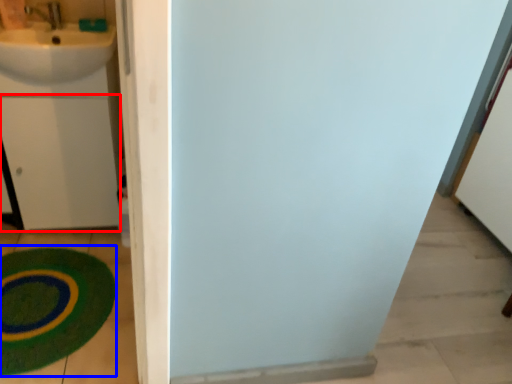
Question: Which point is closer to the camera, drawer (highlighted by a red box) or bath mat (highlighted by a blue box)?

Choices:
 (A) drawer
 (B) bath mat

Answer: (B)